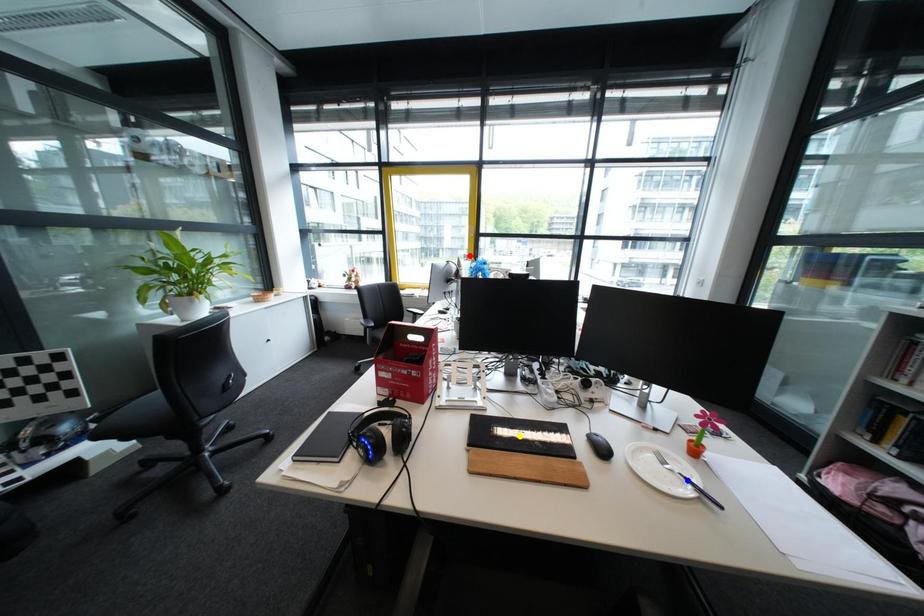
Order these from nearest to farthest:
1. blue point
2. red point
3. yellow point

red point → yellow point → blue point